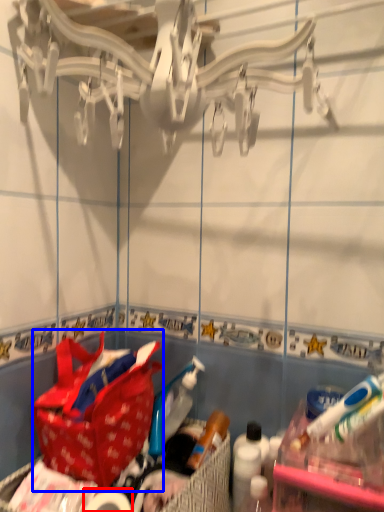
Question: Which point is closer to the camera, toilet paper (highlighted by a red box) or handbag (highlighted by a blue box)?

Choices:
 (A) toilet paper
 (B) handbag

Answer: (A)